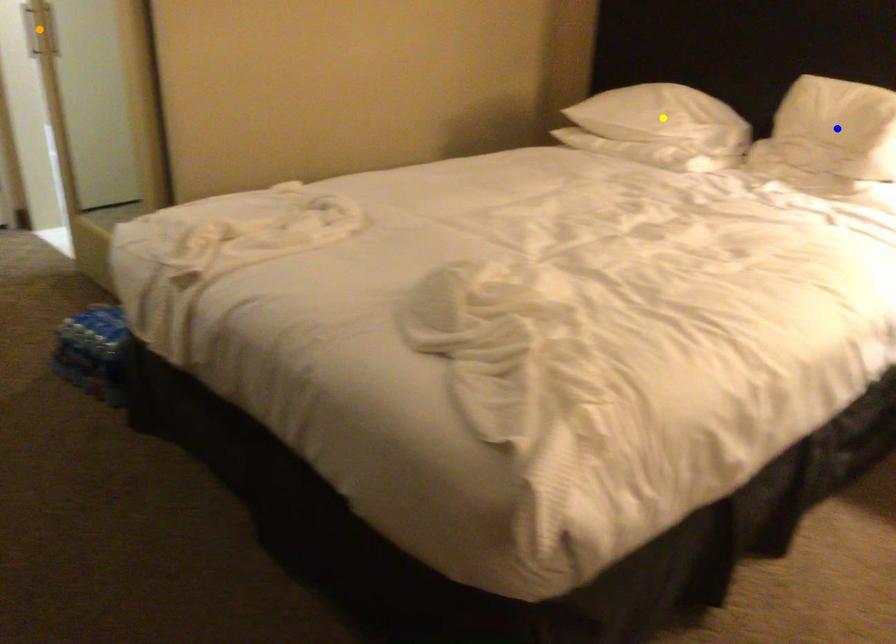
Order these from nearest to farthest:
1. blue point
2. yellow point
3. orange point

blue point → yellow point → orange point